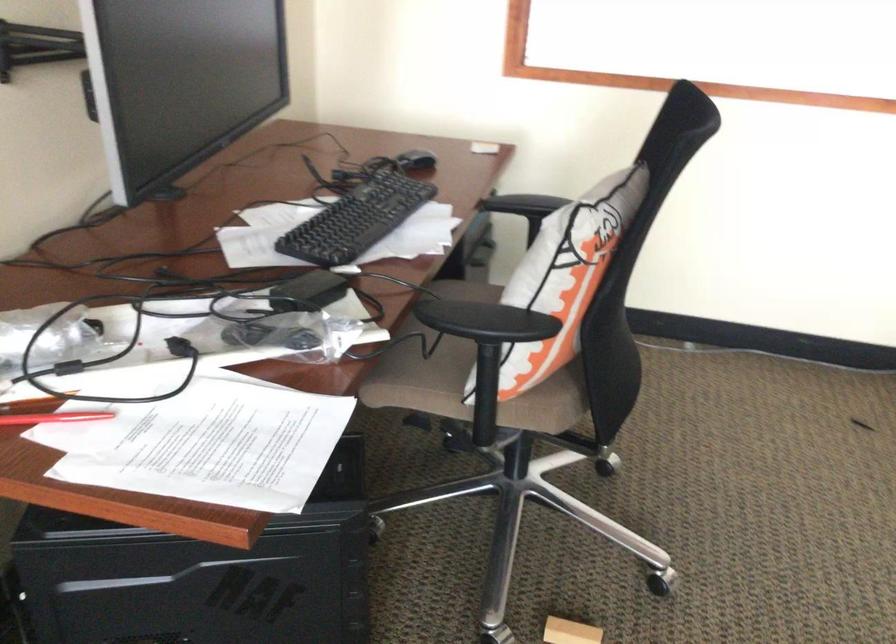
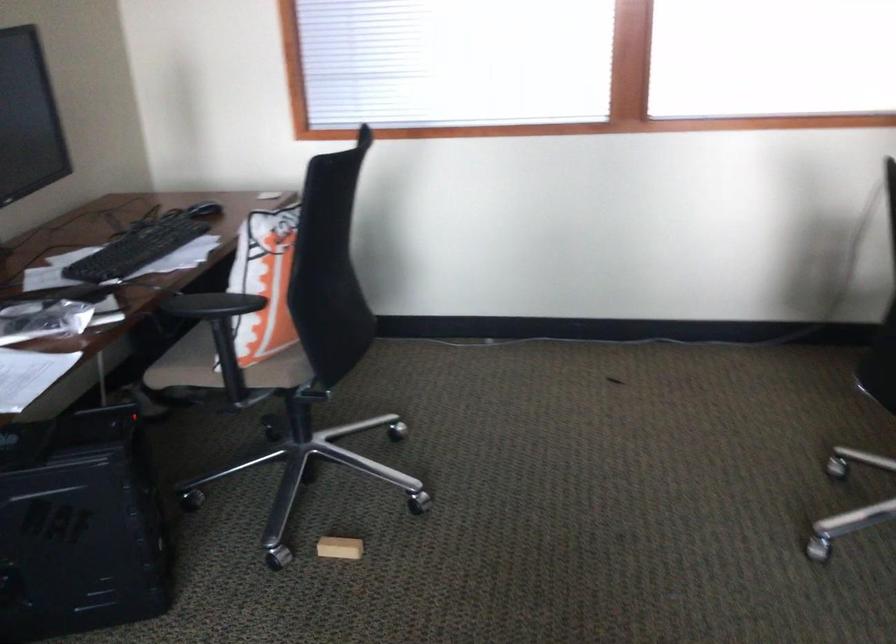
Where in the second image is the point corresponding to the point at 419,164 from the first image?

(204, 210)